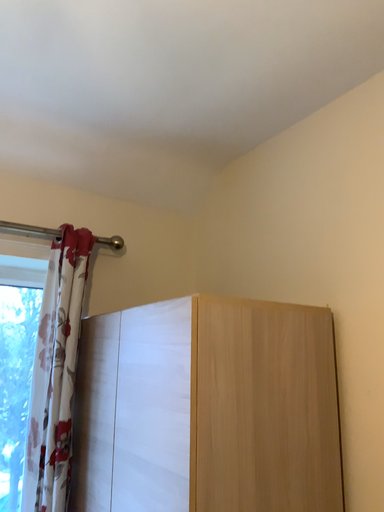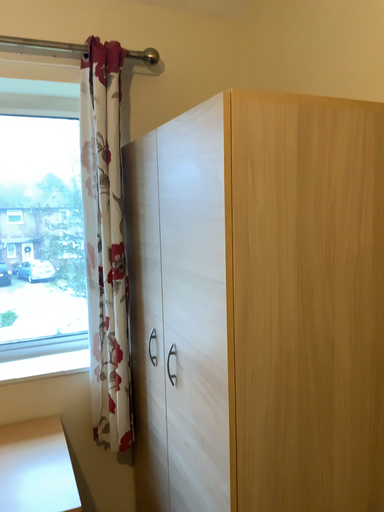
Question: How did the camera likely rotate when shooting the video?

Choices:
 (A) rotated downward
 (B) rotated upward

Answer: (A)